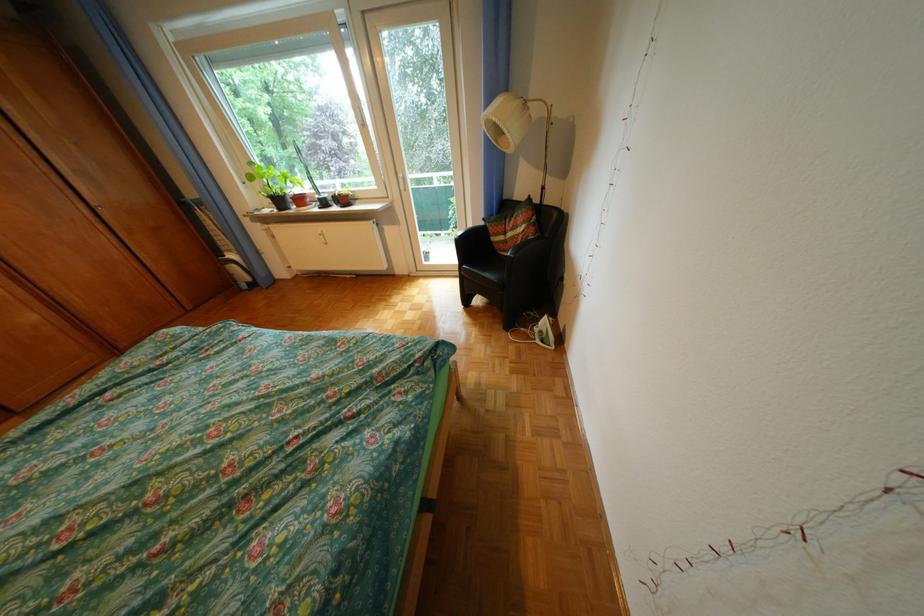
Where is `glass door handle`? glass door handle is located at coordinates (406, 185).